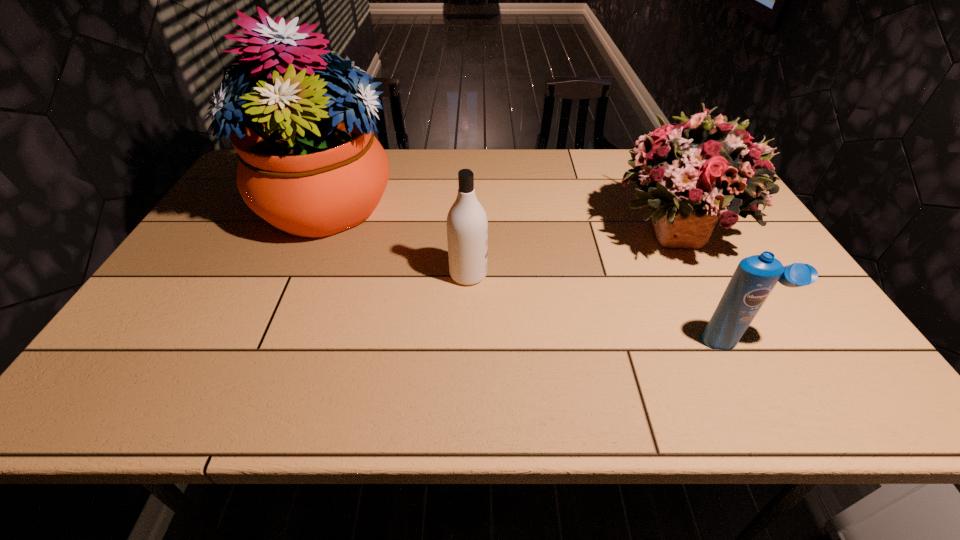
Where is `object that is the third closest to the shortest object`? object that is the third closest to the shortest object is located at coordinates (310, 165).

At what (x,y) coordinates should I click in order to perform the action: click on free point that satisfies the following two spatial constraints: 1. on the front-facing side of the nearer shampoo; 2. on the right side of the left shampoo. Please return your answer as a coordinate pair (x, y). Image resolution: width=960 pixels, height=540 pixels. Looking at the image, I should click on (467, 341).

I want to click on free space that satisfies the following two spatial constraints: 1. on the front-facing side of the third object from right to left; 2. on the right side of the nearer shampoo, so coord(467,341).